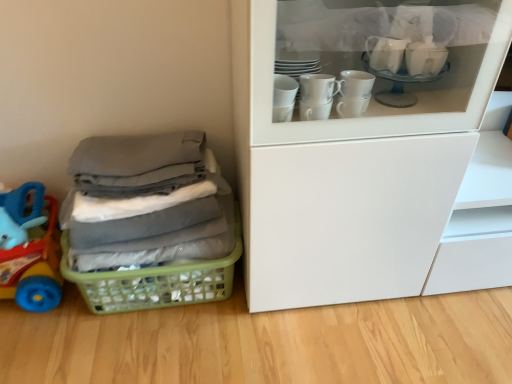
Question: From the image's perspective, is gray fabric at left on green plastic basket at lower left?

Choices:
 (A) yes
 (B) no

Answer: (A)

Question: Can you confirm if gray fabric at left is taller than green plastic basket at lower left?

Choices:
 (A) no
 (B) yes

Answer: (B)

Question: Considering the relative sizes of gray fabric at left and green plastic basket at lower left in the image provided, is gray fabric at left thinner than green plastic basket at lower left?

Choices:
 (A) yes
 (B) no

Answer: (A)

Question: Considering the relative positions of gray fabric at left and green plastic basket at lower left in the image provided, is gray fabric at left in front of green plastic basket at lower left?

Choices:
 (A) yes
 (B) no

Answer: (A)

Question: Considering the relative sizes of gray fabric at left and green plastic basket at lower left in the image provided, is gray fabric at left wider than green plastic basket at lower left?

Choices:
 (A) no
 (B) yes

Answer: (A)

Question: Is rubberized blue toy at left bigger or smaller than green plastic basket at lower left?

Choices:
 (A) small
 (B) big

Answer: (A)

Question: Considering the positions of rubberized blue toy at left and green plastic basket at lower left in the image, is rubberized blue toy at left wider or thinner than green plastic basket at lower left?

Choices:
 (A) thin
 (B) wide

Answer: (A)

Question: Does point (53, 273) appear closer or farther from the camera than point (198, 299)?

Choices:
 (A) closer
 (B) farther

Answer: (A)

Question: From a real-world perspective, is rubberized blue toy at left physically located above or below green plastic basket at lower left?

Choices:
 (A) above
 (B) below

Answer: (A)

Question: Looking at the image, does rubberized blue toy at left seem bigger or smaller compared to gray fabric at left?

Choices:
 (A) big
 (B) small

Answer: (B)

Question: Is rubberized blue toy at left situated inside gray fabric at left or outside?

Choices:
 (A) outside
 (B) inside

Answer: (A)

Question: Considering their positions, is rubberized blue toy at left located in front of or behind gray fabric at left?

Choices:
 (A) front
 (B) behind

Answer: (B)

Question: From a real-world perspective, relative to gray fabric at left, is rubberized blue toy at left vertically above or below?

Choices:
 (A) below
 (B) above

Answer: (A)

Question: In terms of size, does green plastic basket at lower left appear bigger or smaller than rubberized blue toy at left?

Choices:
 (A) small
 (B) big

Answer: (B)

Question: Is green plastic basket at lower left to the left or to the right of rubberized blue toy at left in the image?

Choices:
 (A) left
 (B) right

Answer: (B)